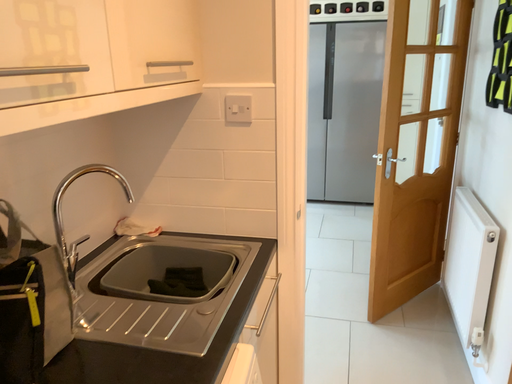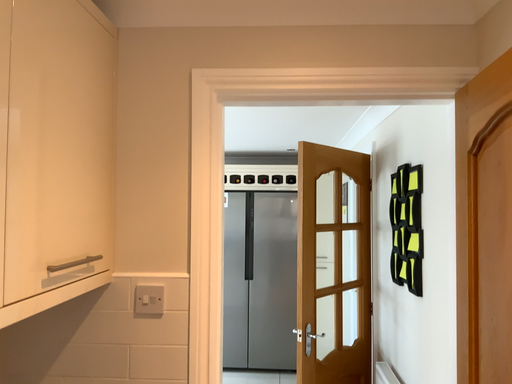
Question: How did the camera likely rotate when shooting the video?

Choices:
 (A) rotated left
 (B) rotated right

Answer: (B)